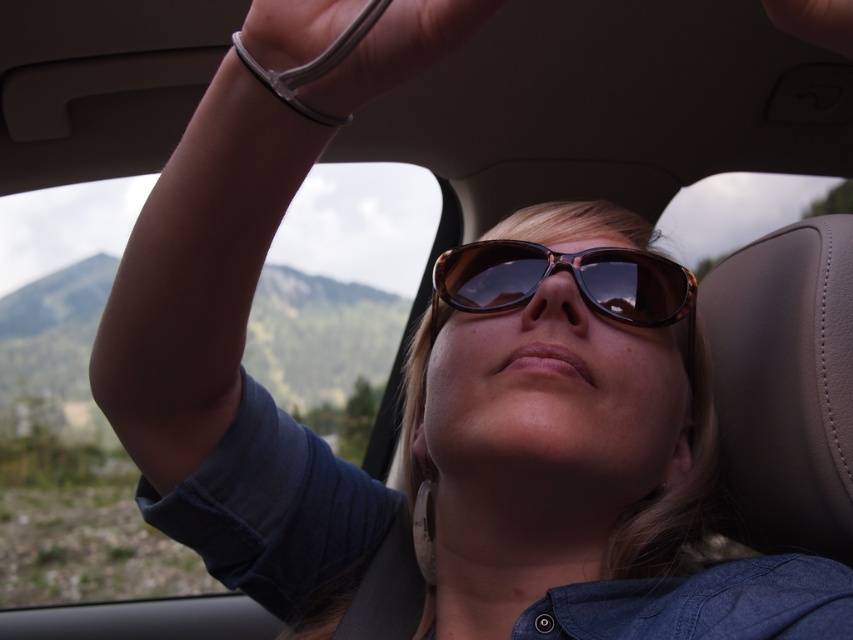
Does tortoiseshell sunglasses at center have a lesser width compared to dark skin at upper center?

No, tortoiseshell sunglasses at center is not thinner than dark skin at upper center.

Does point (549, 259) lie in front of point (798, 19)?

No, (549, 259) is behind (798, 19).

Where is `tortoiseshell sunglasses at center`? The width and height of the screenshot is (853, 640). tortoiseshell sunglasses at center is located at coordinates (572, 276).

Is clear plastic wristband at upper center smaller than tortoiseshell sunglasses at center?

Yes, clear plastic wristband at upper center is smaller than tortoiseshell sunglasses at center.

Can you confirm if clear plastic wristband at upper center is positioned to the right of tortoiseshell sunglasses at center?

Incorrect, clear plastic wristband at upper center is not on the right side of tortoiseshell sunglasses at center.

Between point (277, 93) and point (519, 268), which one is positioned in front?

Point (277, 93) is in front.

You are a GUI agent. You are given a task and a screenshot of the screen. Output one action in this format:
    pyautogui.click(x=<x>, y=<y>)
    Task: Click on the clear plastic wristband at upper center
    The height and width of the screenshot is (640, 853).
    Given the screenshot: What is the action you would take?
    pyautogui.click(x=350, y=49)

Is clear plastic wristband at upper center below dark skin at upper center?

No.

Is clear plastic wristband at upper center taller than dark skin at upper center?

Correct, clear plastic wristband at upper center is much taller as dark skin at upper center.

Between point (329, 22) and point (846, 51), which one is positioned in front?

Positioned in front is point (846, 51).

Image resolution: width=853 pixels, height=640 pixels. I want to click on clear plastic wristband at upper center, so click(350, 49).